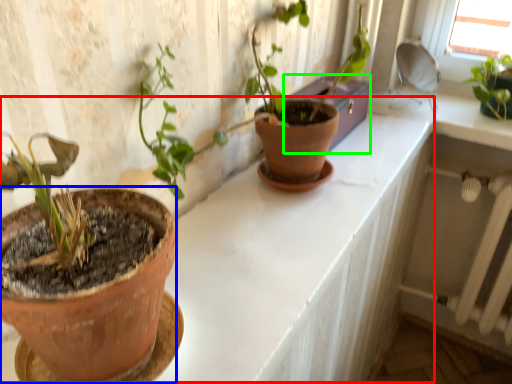
Question: Which is nearer to the counter (highlighted by a red box)? flowerpot (highlighted by a blue box) or window box (highlighted by a green box).

Choices:
 (A) flowerpot
 (B) window box

Answer: (B)